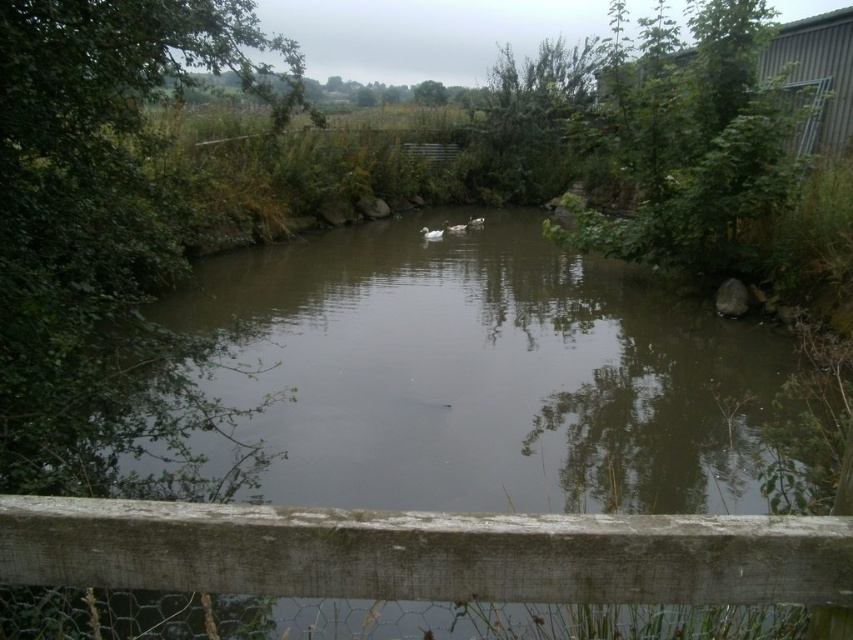
Question: Which is nearer to the brown murky water at center?

Choices:
 (A) white matte duck at center
 (B) weathered wood fence at lower center

Answer: (B)

Question: Which object appears farthest from the camera in this image?

Choices:
 (A) brown murky water at center
 (B) white matte duck at center

Answer: (B)

Question: Can you confirm if weathered wood fence at lower center is smaller than white matte duck at center?

Choices:
 (A) yes
 (B) no

Answer: (A)

Question: Can you confirm if brown murky water at center is bigger than white matte duck at center?

Choices:
 (A) no
 (B) yes

Answer: (B)

Question: Does brown murky water at center lie in front of weathered wood fence at lower center?

Choices:
 (A) yes
 (B) no

Answer: (B)

Question: Which of the following is the farthest from the observer?

Choices:
 (A) (276, 577)
 (B) (490, 289)

Answer: (B)